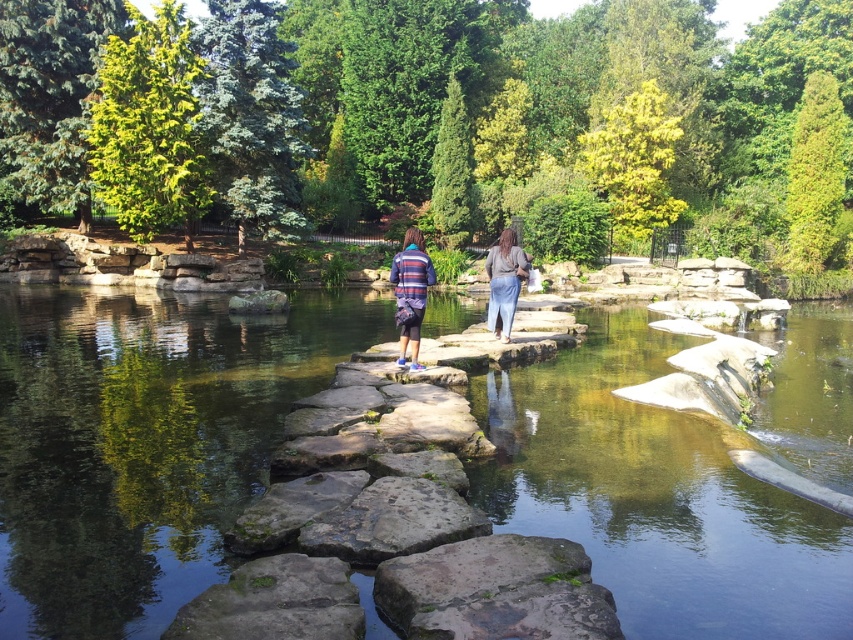
Is clear stone pond at center taller than striped sweater at center?

Yes.

Is point (494, 394) less distant than point (415, 300)?

No, it is behind (415, 300).

At what (x,y) coordinates should I click in order to perform the action: click on clear stone pond at center. Please return your answer as a coordinate pair (x, y). This screenshot has height=640, width=853. Looking at the image, I should click on (142, 444).

Is striped fabric jacket at center behind denim pants at center?

A: No.

This screenshot has width=853, height=640. I want to click on striped fabric jacket at center, so click(410, 291).

Identify the location of striped fabric jacket at center. (410, 291).

Is clear stone pond at center positioned before denim pants at center?

Yes, it is.

Does clear stone pond at center appear over denim pants at center?

Incorrect, clear stone pond at center is not positioned above denim pants at center.

The image size is (853, 640). I want to click on clear stone pond at center, so point(142,444).